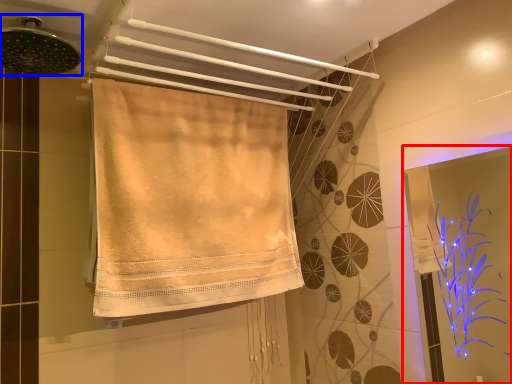
Question: Which of the following is the closest to the observer, screen door (highlighted by a red box) or shower (highlighted by a blue box)?

Choices:
 (A) screen door
 (B) shower

Answer: (B)